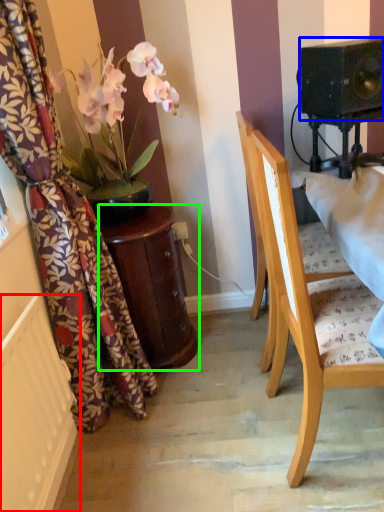
Question: Based on their relative distances, which object is farther from radiator (highlighted by a red box)? Choose from speaker (highlighted by a blue box) and table (highlighted by a green box).

Choices:
 (A) speaker
 (B) table

Answer: (A)